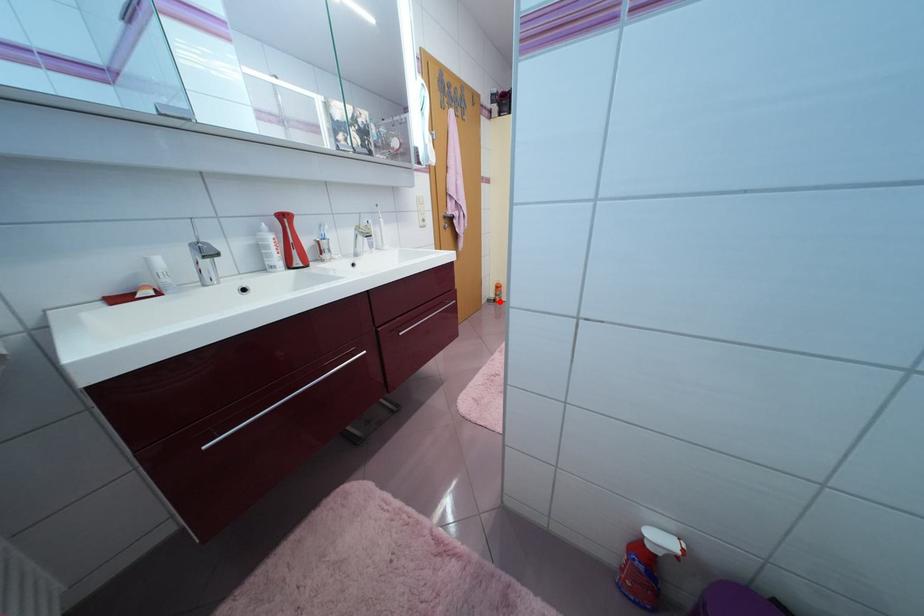
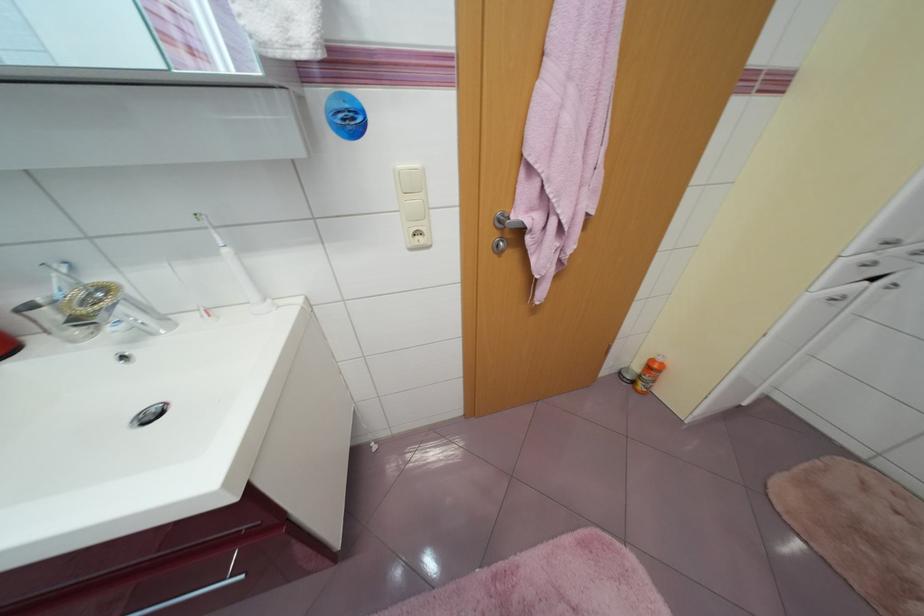
Question: I am providing you with two images of the same scene from different viewpoints. Image1 has a red point marked. In image2, the corresponding 3D location appears at what relative position? Reply with the corresponding letter.

Choices:
 (A) Closer
 (B) Farther

Answer: (B)